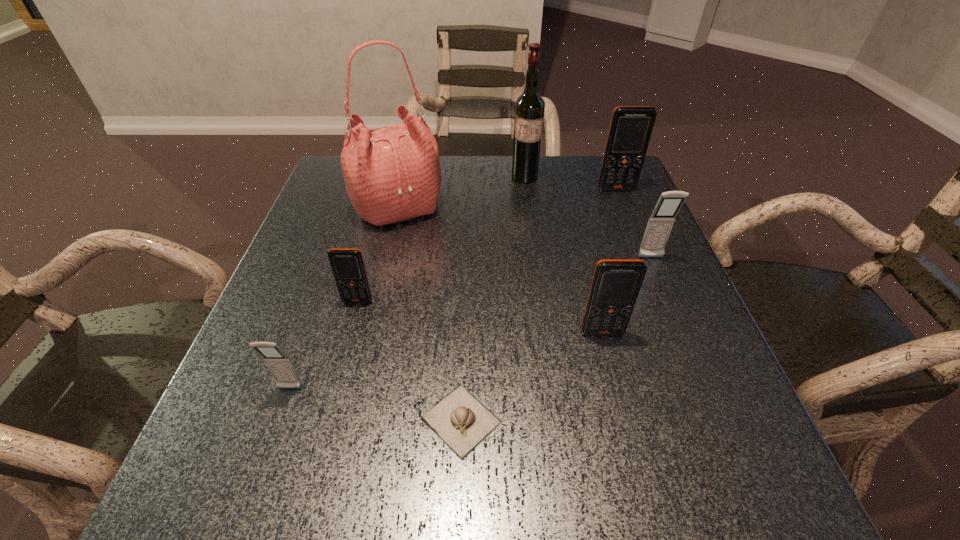
What are the coordinates of `vacant area at the near edge of the desktop` in the screenshot? It's located at (395, 475).

Image resolution: width=960 pixels, height=540 pixels. In order to click on free space at the left edge in this screenshot , I will do `click(298, 259)`.

In the image, there is a desktop. Where is `vacant space at the right edge`? This screenshot has height=540, width=960. vacant space at the right edge is located at coordinates (650, 430).

Where is `vacant space at the near left corner of the desktop`? The image size is (960, 540). vacant space at the near left corner of the desktop is located at coordinates (197, 458).

In the image, there is a desktop. Where is `vacant space at the near right corner`? This screenshot has width=960, height=540. vacant space at the near right corner is located at coordinates (738, 508).

Where is `free area in between the fifth object from left to right and the second orange cellular telephone from right to left`? free area in between the fifth object from left to right and the second orange cellular telephone from right to left is located at coordinates (564, 255).

You are a GUI agent. You are given a task and a screenshot of the screen. Output one action in this format:
    pyautogui.click(x=<x>, y=<y>)
    Task: Click on the unoccupied position between the farthest orange cellular telephone and the fourth nearest cellular telephone
    
    Given the screenshot: What is the action you would take?
    pyautogui.click(x=634, y=224)

This screenshot has width=960, height=540. I want to click on free space between the handbag and the farthest object, so click(461, 193).

In order to click on unoccupied area between the handbag and the farthest object in this screenshot , I will do `click(461, 193)`.

Locate an element on the screen. Image resolution: width=960 pixels, height=540 pixels. blank region between the handbag and the smallest orange cellular telephone is located at coordinates (377, 255).